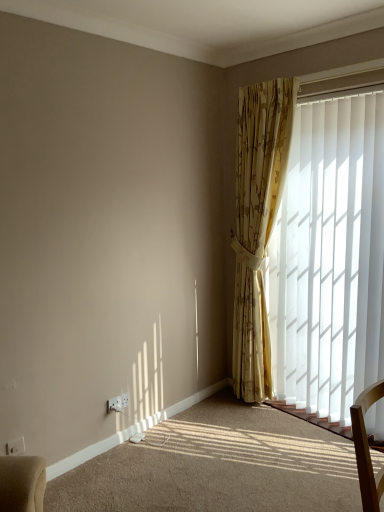
Question: From the image's perspective, is gold floral curtain at right under white plastic window frame at upper right?

Choices:
 (A) no
 (B) yes

Answer: (B)

Question: Considering the relative sizes of gold floral curtain at right and white plastic window frame at upper right in the image provided, is gold floral curtain at right taller than white plastic window frame at upper right?

Choices:
 (A) yes
 (B) no

Answer: (A)

Question: Is gold floral curtain at right shorter than white plastic window frame at upper right?

Choices:
 (A) yes
 (B) no

Answer: (B)

Question: Is gold floral curtain at right far from white plastic window frame at upper right?

Choices:
 (A) no
 (B) yes

Answer: (A)

Question: Does gold floral curtain at right appear on the right side of white plastic window frame at upper right?

Choices:
 (A) yes
 (B) no

Answer: (B)

Question: Is the depth of gold floral curtain at right greater than that of white plastic window frame at upper right?

Choices:
 (A) yes
 (B) no

Answer: (A)

Question: Is white plastic electric outlet at lower left, which is counted as the first electric outlet, starting from the back, to the right of white plastic electric outlet at lower left, the 2th electric outlet from the back, from the viewer's perspective?

Choices:
 (A) yes
 (B) no

Answer: (A)

Question: Is white plastic electric outlet at lower left, positioned as the 2th electric outlet in front-to-back order, bigger than white plastic electric outlet at lower left, placed as the first electric outlet when sorted from front to back?

Choices:
 (A) no
 (B) yes

Answer: (B)

Question: From the image's perspective, does white plastic electric outlet at lower left, which is counted as the first electric outlet, starting from the back, appear lower than white plastic electric outlet at lower left, the 2th electric outlet from the back?

Choices:
 (A) yes
 (B) no

Answer: (B)

Question: Does white plastic electric outlet at lower left, which ranks as the second electric outlet in left-to-right order, have a smaller size compared to white plastic electric outlet at lower left, marked as the 2th electric outlet in a right-to-left arrangement?

Choices:
 (A) no
 (B) yes

Answer: (A)

Question: Is white plastic electric outlet at lower left, which is counted as the first electric outlet, starting from the back, positioned before white plastic electric outlet at lower left, the 2th electric outlet from the back?

Choices:
 (A) no
 (B) yes

Answer: (A)

Question: Does white plastic electric outlet at lower left, positioned as the 2th electric outlet in front-to-back order, appear on the left side of white plastic electric outlet at lower left, placed as the first electric outlet when sorted from front to back?

Choices:
 (A) yes
 (B) no

Answer: (B)

Question: Is white vertical blinds at right further to the viewer compared to white plastic window frame at upper right?

Choices:
 (A) yes
 (B) no

Answer: (B)